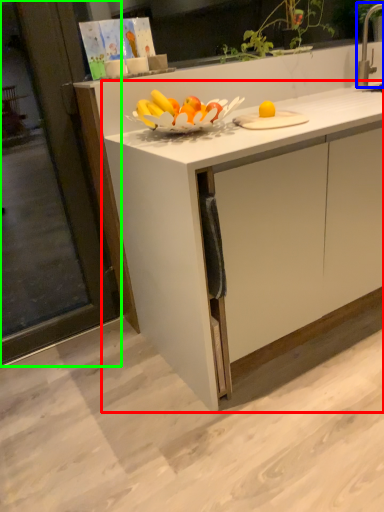
Question: Based on their relative distances, which object is farther from cabinetry (highlighted by a red box)? Choose from faucet (highlighted by a blue box) and screen door (highlighted by a green box).

Choices:
 (A) faucet
 (B) screen door

Answer: (A)